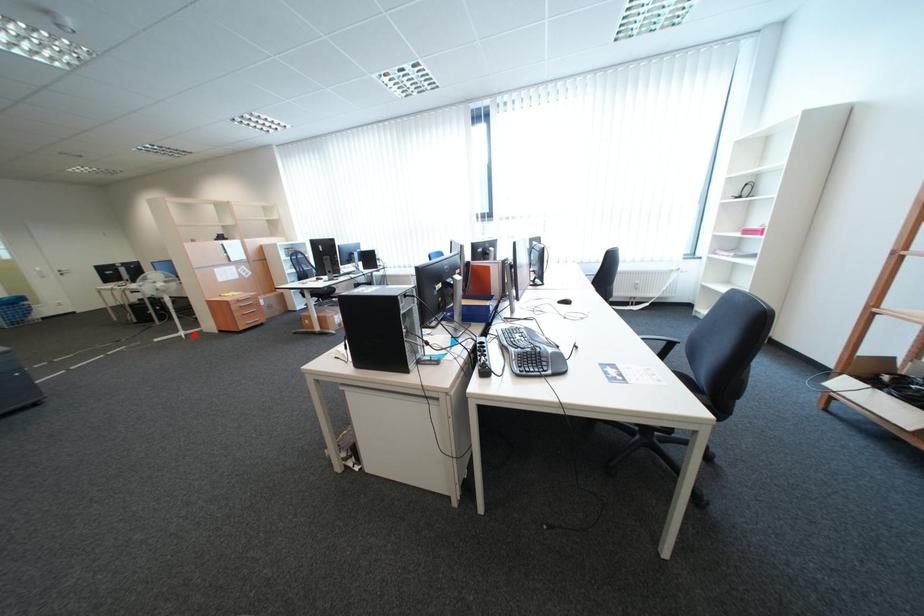
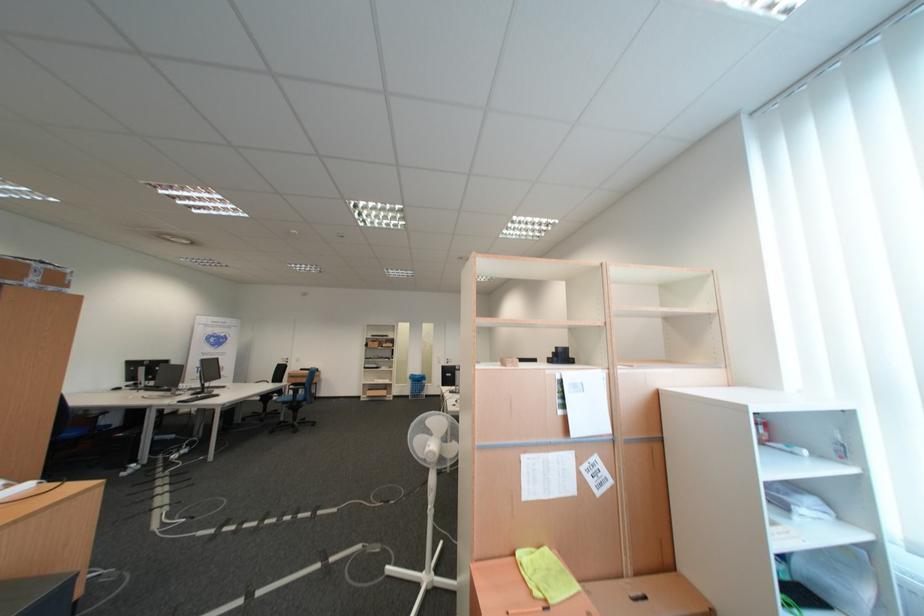
The point at the highlighted location is marked in the first image. Where is the corresponding point in the second image?

(439, 578)